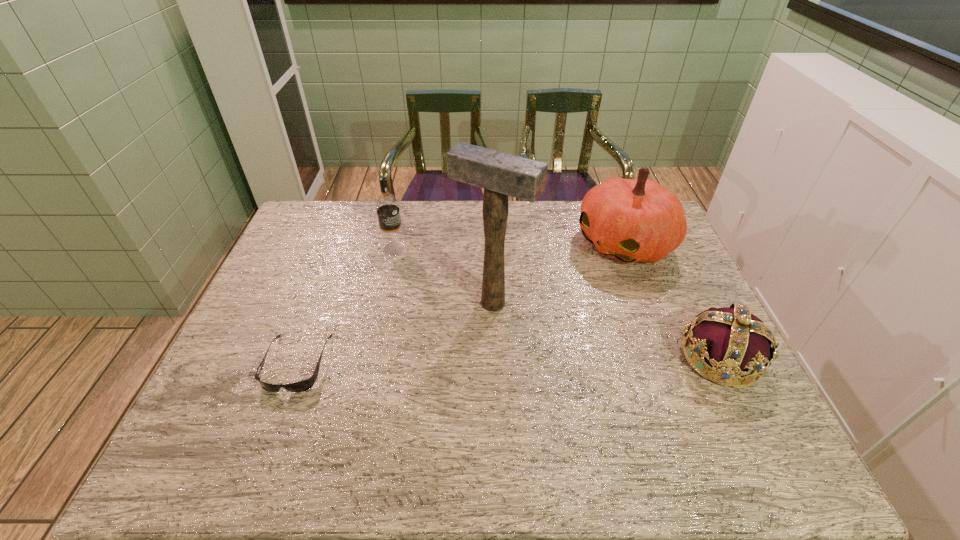
Find the location of a particular element. This screenshot has width=960, height=540. sunglasses is located at coordinates (304, 385).

Locate an element on the screen. the leftmost object is located at coordinates (304, 385).

This screenshot has width=960, height=540. I want to click on the fourth tallest object, so click(x=735, y=342).

Find the location of a particular element. This screenshot has width=960, height=540. pumpkin is located at coordinates (633, 220).

Find the location of a particular element. The width and height of the screenshot is (960, 540). vodka is located at coordinates (387, 207).

You are a GUI agent. You are given a task and a screenshot of the screen. Output one action in this format:
    pyautogui.click(x=<x>, y=<y>)
    Task: Click on the third object from right to left
    The height and width of the screenshot is (540, 960).
    Given the screenshot: What is the action you would take?
    pyautogui.click(x=501, y=175)

Where is `the third nearest object`? the third nearest object is located at coordinates (501, 175).

At what (x,y) coordinates should I click in order to perform the action: click on free spot located 0.070m on the front-facing side of the leftmost object. Please return your answer as a coordinate pair (x, y). The width and height of the screenshot is (960, 540). Looking at the image, I should click on (276, 421).

Locate an element on the screen. The image size is (960, 540). vacant space situated on the front of the second shortest object is located at coordinates (752, 420).

Where is `free point located 0.070m on the front-facing side of the pumpkin`? This screenshot has width=960, height=540. free point located 0.070m on the front-facing side of the pumpkin is located at coordinates (578, 274).